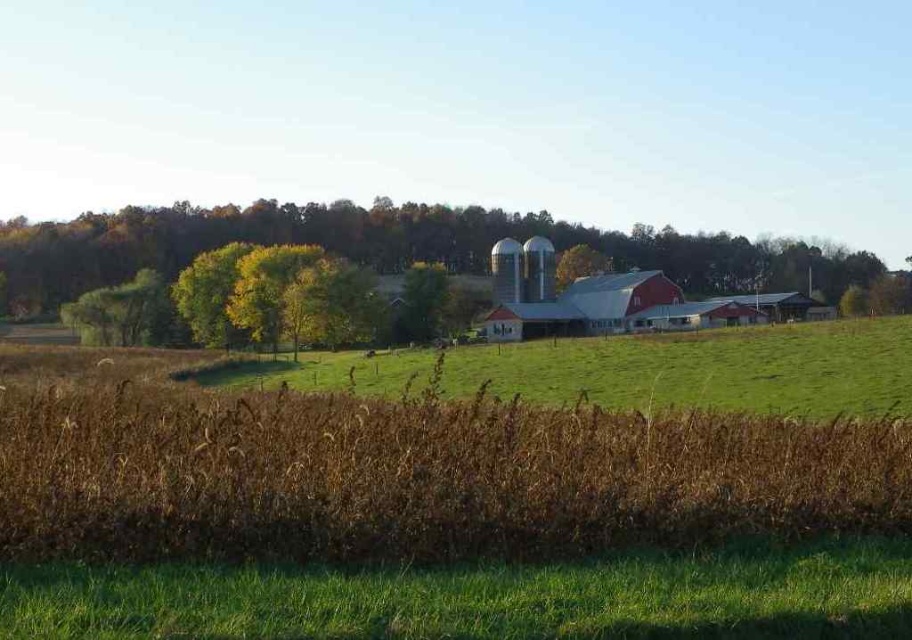
Question: Is green leafy tree at upper center below green leafy tree at center?

Choices:
 (A) no
 (B) yes

Answer: (A)

Question: Which object appears farthest from the camera in this image?

Choices:
 (A) green grassy field at center
 (B) green leafy tree at upper center
 (C) green leafy tree at center

Answer: (C)

Question: Which point is farther to the camera?

Choices:
 (A) green leafy tree at center
 (B) green leafy tree at upper center

Answer: (A)

Question: Can you confirm if green leafy tree at upper center is thinner than green grassy field at center?

Choices:
 (A) no
 (B) yes

Answer: (A)

Question: Which object appears farthest from the camera in this image?

Choices:
 (A) green leafy tree at upper center
 (B) green leafy tree at center

Answer: (B)

Question: Can you confirm if green leafy tree at upper center is positioned to the left of green leafy tree at center?

Choices:
 (A) yes
 (B) no

Answer: (A)